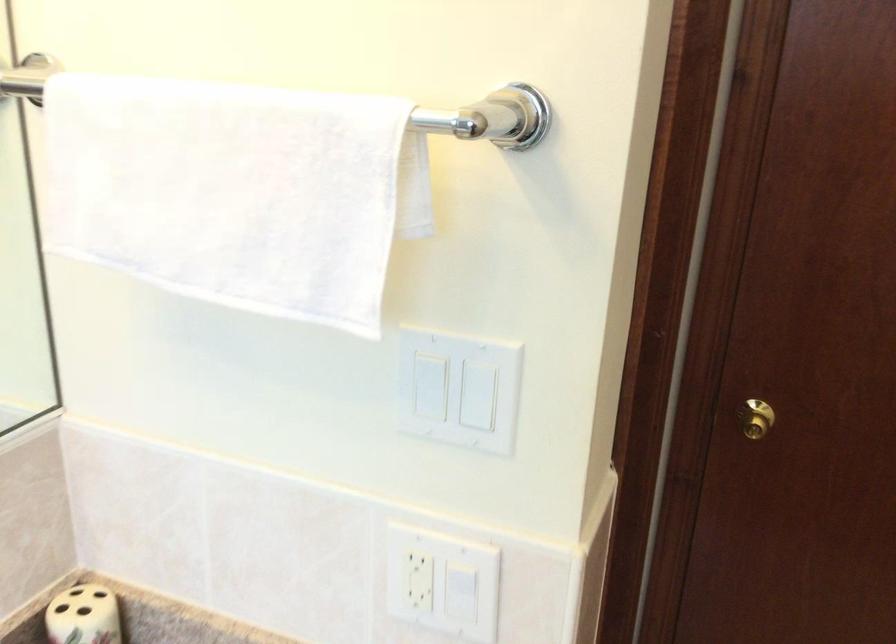
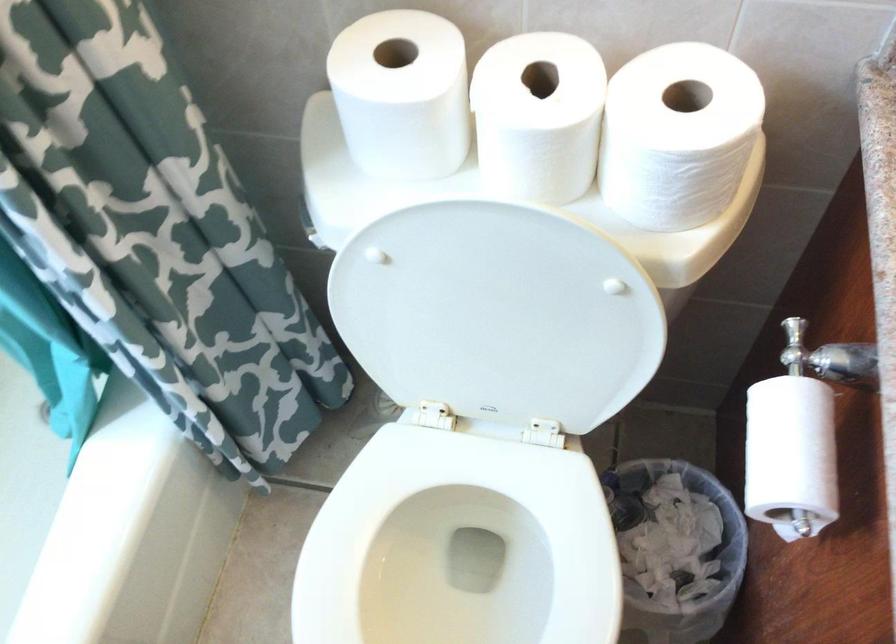
The images are taken continuously from a first-person perspective. In which direction is your viewpoint rotating?

The rotation direction of the camera is left-down.